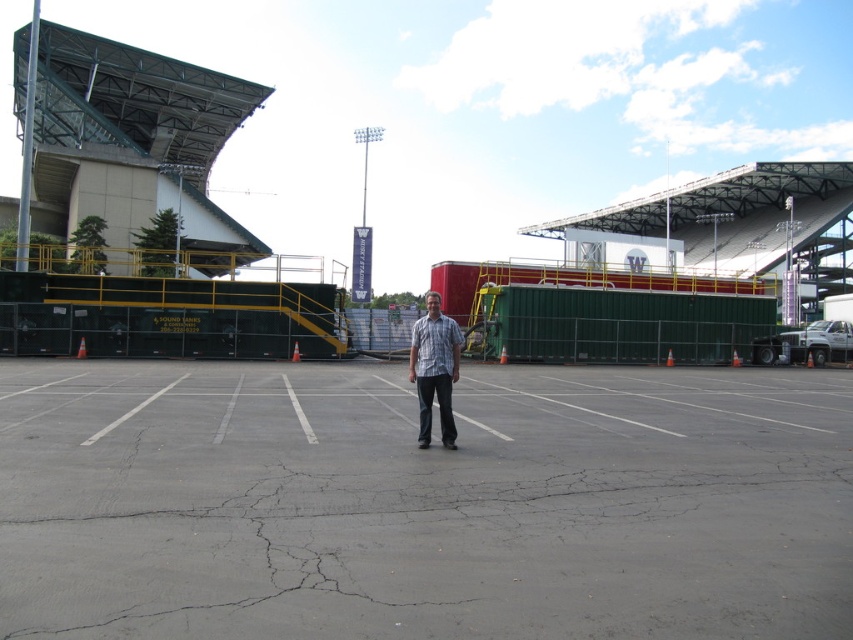
Between point (428, 620) and point (424, 412), which one is positioned behind?

The point (424, 412) is more distant.

Where is `gray asphalt parking lot at center`? The height and width of the screenshot is (640, 853). gray asphalt parking lot at center is located at coordinates (422, 502).